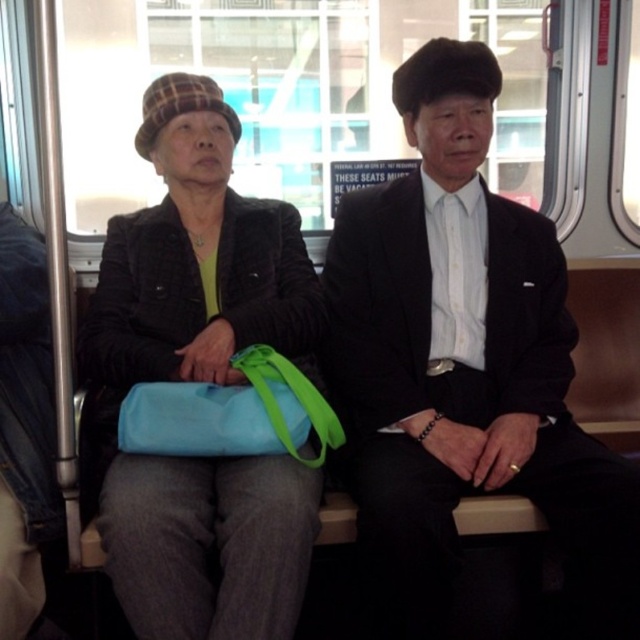
Does black smooth suit at center have a lesser height compared to blue fabric bag at center?

Incorrect, black smooth suit at center's height does not fall short of blue fabric bag at center's.

Which is below, black smooth suit at center or blue fabric bag at center?

Positioned lower is blue fabric bag at center.

Describe the element at coordinates (465, 364) in the screenshot. I see `black smooth suit at center` at that location.

Identify the location of black smooth suit at center. This screenshot has width=640, height=640. (465, 364).

Is matte black jacket at center behind blue fabric bag at center?

No.

Based on the photo, does matte black jacket at center have a greater height compared to blue fabric bag at center?

Indeed, matte black jacket at center has a greater height compared to blue fabric bag at center.

Is point (241, 340) closer to viewer compared to point (321, 428)?

No, it is not.

Where is `matte black jacket at center`? The image size is (640, 640). matte black jacket at center is located at coordinates (195, 259).

Does black smooth suit at center have a greater height compared to matte black jacket at center?

Correct, black smooth suit at center is much taller as matte black jacket at center.

Is black smooth suit at center positioned at the back of matte black jacket at center?

Yes, black smooth suit at center is further from the viewer.

In order to click on black smooth suit at center in this screenshot , I will do `click(465, 364)`.

The width and height of the screenshot is (640, 640). I want to click on black smooth suit at center, so click(x=465, y=364).